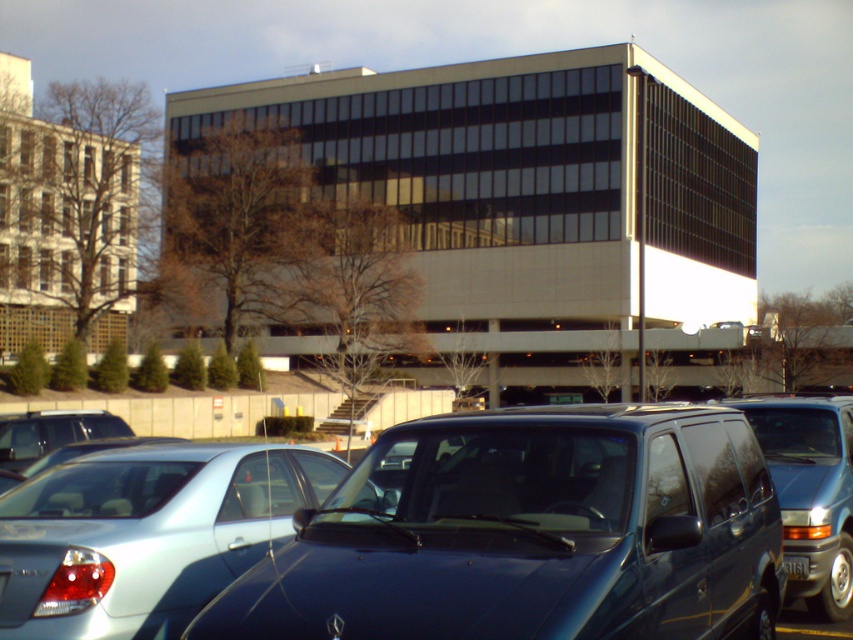
You are a delivery driver who needs to park your truck, which is 2 meters tall, in this parking lot. The parking spot is between the matte blue van at center and the silver metallic sedan at center. Can your truck fit vertically between them?

The matte blue van at center is much taller than the silver metallic sedan at center. Since the truck is 2 meters tall, it depends on the height of the shorter vehicle. However, without specific height measurements, it is impossible to determine if the truck can fit vertically between them.

You are a delivery driver who needs to back up your truck to load packages. Your truck is currently parked between the matte blue van at center and the silver metallic sedan at center. The truck is 40 feet long. Can you safely back up your truck without hitting either vehicle?

The matte blue van at center is 39.53 feet from the silver metallic sedan at center. Since your truck is 40 feet long, it would extend beyond the space between them, so you cannot safely back up without risking a collision.

You are a delivery person trying to park your truck between the glossy dark blue van at center and the satin silver sedan at center. Based on the scene, which vehicle should you position your truck closer to in order to fit properly?

The glossy dark blue van at center is smaller in size compared to the satin silver sedan at center. Therefore, positioning the truck closer to the glossy dark blue van at center would provide more space for the truck to fit properly between them.